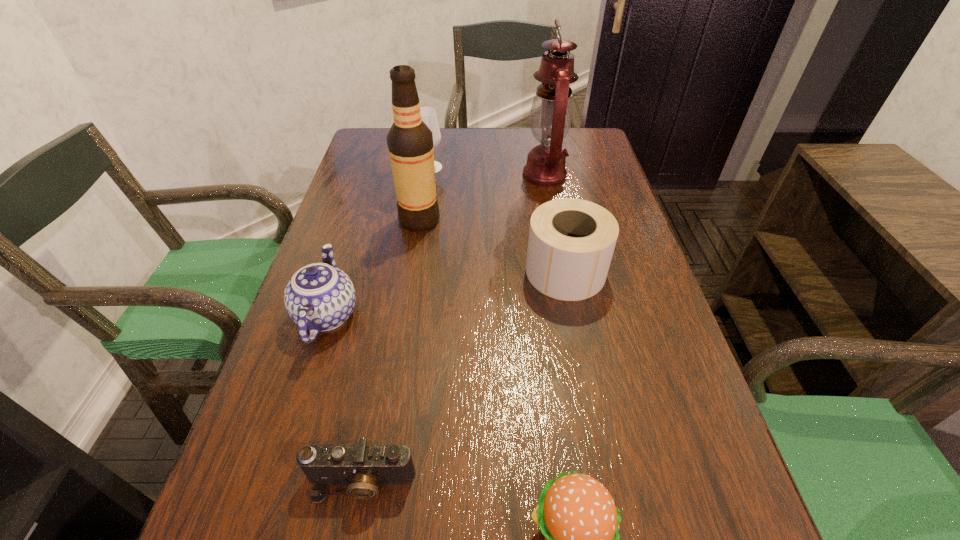
This screenshot has height=540, width=960. I want to click on free space located 0.180m at the spout of the chinaware, so click(x=355, y=226).

You are a GUI agent. You are given a task and a screenshot of the screen. Output one action in this format:
    pyautogui.click(x=<x>, y=<y>)
    Task: Click on the vacant region located 0.230m at the spout of the chinaware
    
    Given the screenshot: What is the action you would take?
    pyautogui.click(x=359, y=214)

This screenshot has width=960, height=540. Find the location of `free spot located at the spout of the chinaware`. free spot located at the spout of the chinaware is located at coordinates (361, 210).

You are a GUI agent. You are given a task and a screenshot of the screen. Output one action in this format:
    pyautogui.click(x=<x>, y=<y>)
    Task: Click on the oil lamp that is at the far edge
    This screenshot has width=960, height=540.
    Given the screenshot: What is the action you would take?
    coord(551,114)

Identify the location of glass at the far edge. (428, 115).

At what (x,y) coordinates should I click in order to perform the action: click on chinaware present at the left edge. Please return your answer as a coordinate pair (x, y). Looking at the image, I should click on (319, 297).

Identify the location of camera at the left edge. The height and width of the screenshot is (540, 960). (362, 466).

At what (x,y) coordinates should I click in order to perform the action: click on oil lamp at the right edge. Please return your answer as a coordinate pair (x, y). The height and width of the screenshot is (540, 960). Looking at the image, I should click on (551, 114).

This screenshot has width=960, height=540. Identify the location of toilet tissue that is at the right edge. (571, 242).

Where is `object that is at the far right corner`? object that is at the far right corner is located at coordinates (551, 114).